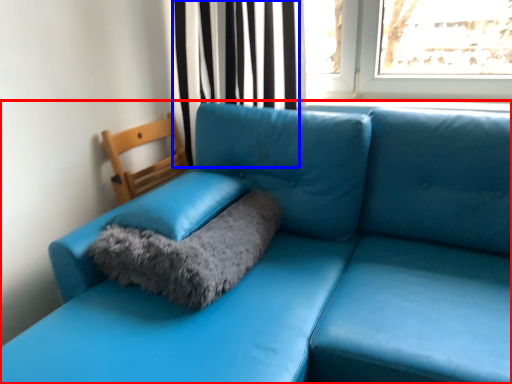
Question: Which object is further to the camera taking this photo, studio couch (highlighted by a red box) or curtain (highlighted by a blue box)?

Choices:
 (A) studio couch
 (B) curtain

Answer: (B)